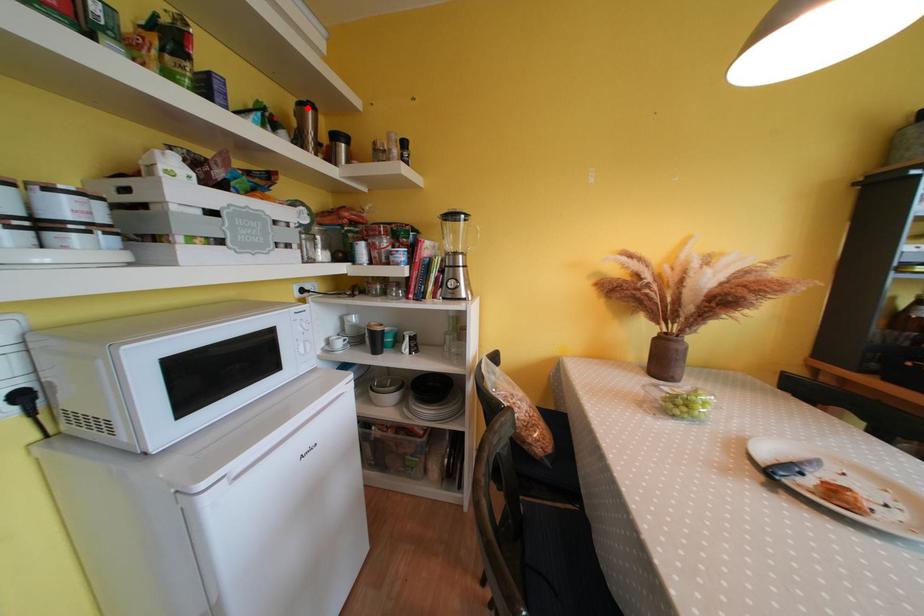
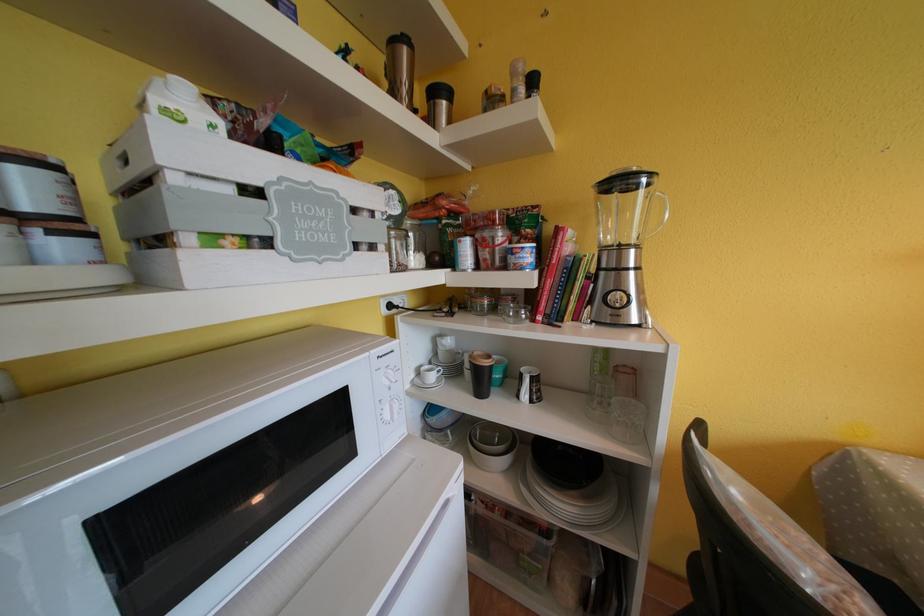
Question: I am providing you with two images of the same scene from different viewpoints. A red point is marked on the first image. Can you still see the location of the red point in image 2?

Choices:
 (A) Yes
 (B) No

Answer: (A)